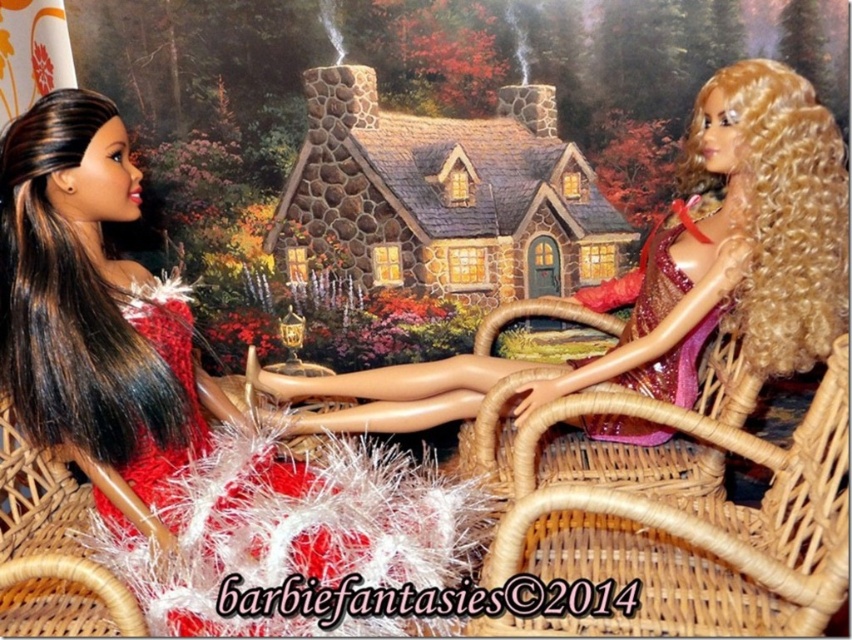
Question: Among these objects, which one is nearest to the camera?

Choices:
 (A) shiny pink fabric at center
 (B) woven wicker chair at center
 (C) shiny red dress at left
 (D) woven wood chair at left

Answer: (B)

Question: Among these objects, which one is nearest to the camera?

Choices:
 (A) shiny red dress at left
 (B) woven wicker chair at center
 (C) shiny pink fabric dress at right
 (D) shiny pink fabric at center

Answer: (B)

Question: Does shiny red dress at left have a greater width compared to woven wicker chair at center?

Choices:
 (A) yes
 (B) no

Answer: (A)

Question: In this image, where is shiny pink fabric at center located relative to woven wood chair at left?

Choices:
 (A) above
 (B) below

Answer: (A)

Question: Which of the following is the farthest from the observer?

Choices:
 (A) (32, 449)
 (B) (751, 141)

Answer: (A)

Question: Is shiny pink fabric at center further to the viewer compared to woven wicker chair at center?

Choices:
 (A) no
 (B) yes

Answer: (B)